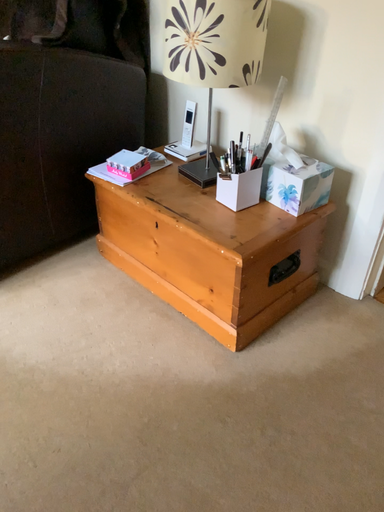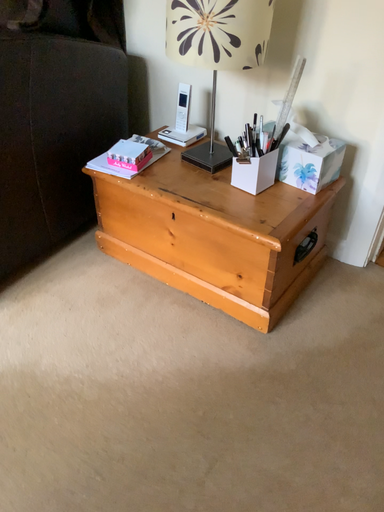
Question: Which way did the camera rotate in the video?

Choices:
 (A) rotated left
 (B) rotated right

Answer: (B)